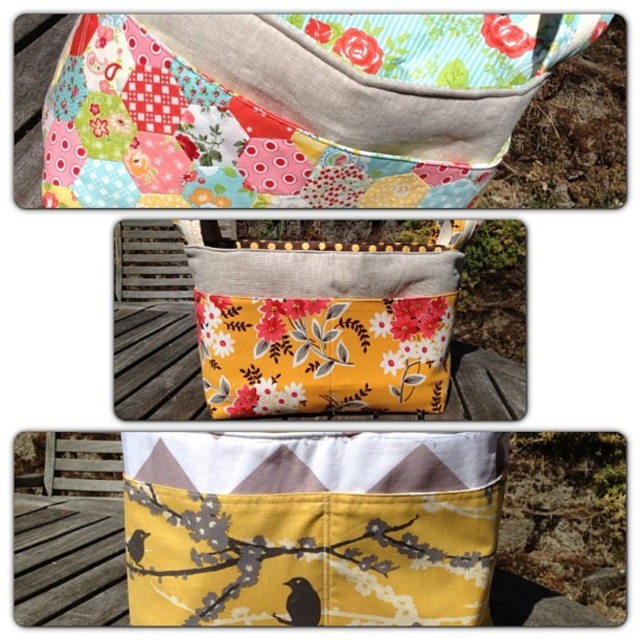
Question: In this image, where is yellow floral fabric pouch at center located relative to black matte bird at lower left?

Choices:
 (A) left
 (B) right

Answer: (B)

Question: Is yellow fabric branch at center thinner than black matte bird at lower center?

Choices:
 (A) yes
 (B) no

Answer: (B)

Question: Which object is closer to the camera taking this photo?

Choices:
 (A) yellow floral fabric pouch at center
 (B) black matte bird at lower center

Answer: (B)

Question: Can you confirm if yellow fabric pouch at center is wider than yellow floral fabric pouch at center?

Choices:
 (A) yes
 (B) no

Answer: (A)

Question: Which point is closer to the camera?

Choices:
 (A) [394, 390]
 (B) [289, 22]
 (C) [284, 605]

Answer: (C)

Question: Estimate the real-world distances between objects in this image. Which object is farther from the black matte bird at lower center?

Choices:
 (A) yellow floral fabric pouch at center
 (B) floral patchwork fabric pouch at upper center

Answer: (B)